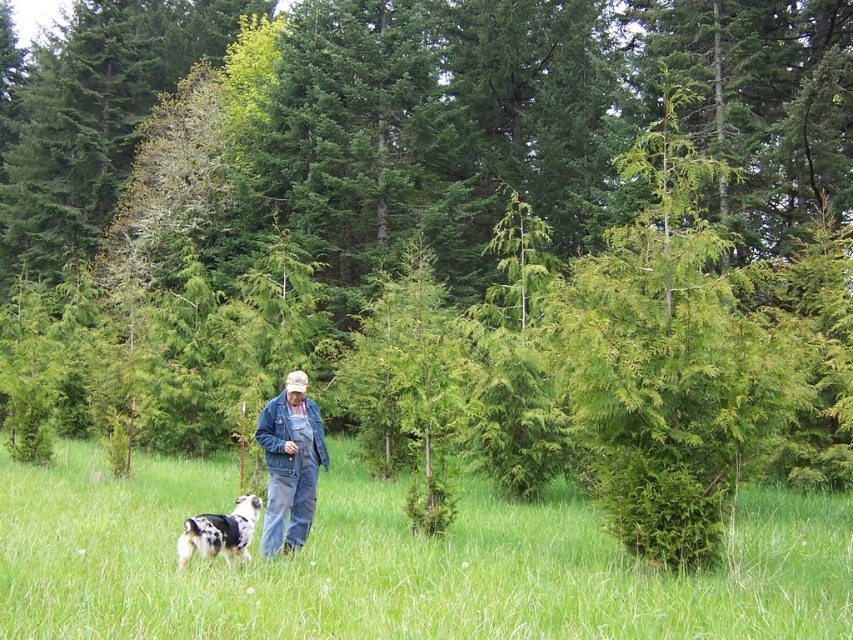
Question: Is green grass at center below spotted fur dog at lower left?

Choices:
 (A) no
 (B) yes

Answer: (B)

Question: In this image, where is denim overalls at center located relative to spotted fur dog at lower left?

Choices:
 (A) left
 (B) right

Answer: (B)

Question: Among these objects, which one is nearest to the camera?

Choices:
 (A) spotted fur dog at lower left
 (B) denim overalls at center
 (C) green grass at center

Answer: (C)

Question: Based on their relative distances, which object is farther from the green grass at center?

Choices:
 (A) spotted fur dog at lower left
 (B) denim overalls at center

Answer: (A)

Question: Which object is positioned closest to the denim overalls at center?

Choices:
 (A) green grass at center
 (B) spotted fur dog at lower left

Answer: (B)

Question: Is green grass at center further to camera compared to denim overalls at center?

Choices:
 (A) no
 (B) yes

Answer: (A)